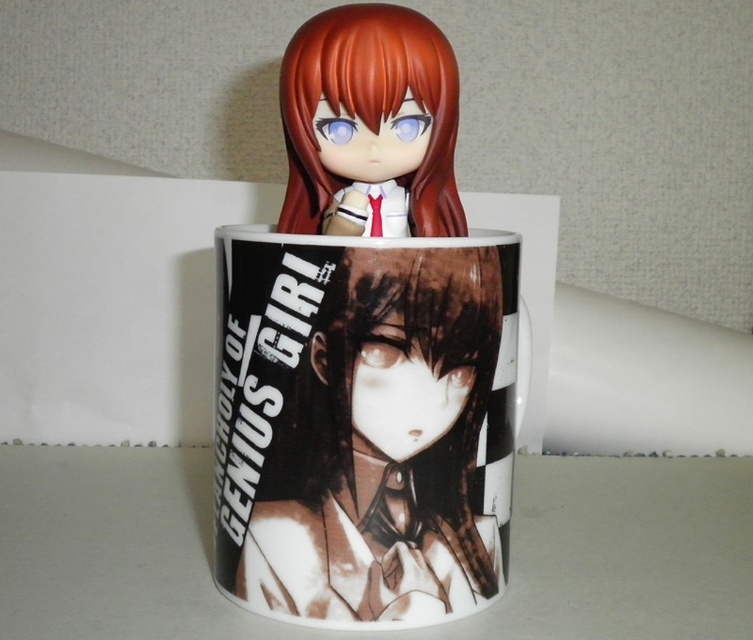
You are trying to determine if the white glossy mug at center can hold the matte plastic doll at upper center without the doll falling out. Based on their sizes, is this possible?

The white glossy mug at center is much taller than the matte plastic doll at upper center, so the doll can fit inside the mug and won not fall out.

You are looking at the ceramic mug with the anime girl design. There are two points marked on the mug. The first point is at coordinates point (398, 400) and the second point is at point (444, 172). Which of these two points is closer to you?

Point (398, 400) is closer to the viewer than point (444, 172).

From the picture: You are a photographer trying to capture a closeup shot of the white glossy mug at center. The camera you are using has a minimum focusing distance of 30 inches. Can you take the photo without moving the mug closer?

The white glossy mug at center is 36.00 inches away from camera, which is beyond the camera minimum focusing distance of 30 inches. So you can take the photo without moving the mug closer.